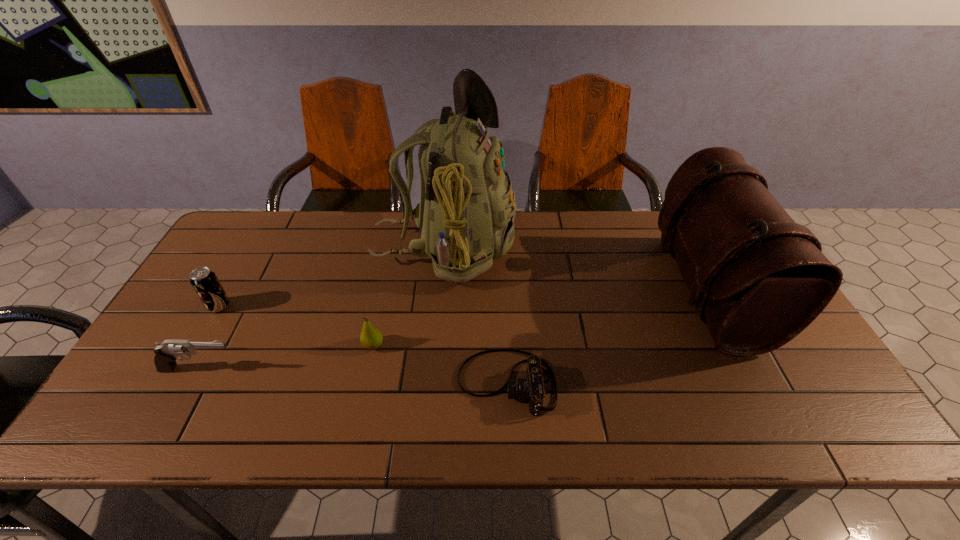
Identify the location of backpack. This screenshot has height=540, width=960. (466, 213).

Locate an element on the screen. This screenshot has height=540, width=960. the second tallest object is located at coordinates (758, 279).

Locate an element on the screen. satchel is located at coordinates (758, 279).

Locate an element on the screen. This screenshot has width=960, height=540. soda can is located at coordinates pos(204,281).

Find the location of a particular element. This screenshot has height=540, width=960. gun is located at coordinates (166, 353).

Identify the location of pear. (371, 338).

Where is `the shortest object`? The height and width of the screenshot is (540, 960). the shortest object is located at coordinates (532, 387).

Identify the location of free space located on the front-facing side of the backpack. (599, 248).

What are the coordinates of `free space located on the front-facing side of the satchel` in the screenshot? It's located at (575, 289).

You are a GUI agent. You are given a task and a screenshot of the screen. Output one action in this format:
    pyautogui.click(x=<x>, y=<y>)
    Task: Click on the free space located 0.330m on the front-facing side of the satchel
    
    Given the screenshot: What is the action you would take?
    pyautogui.click(x=547, y=289)